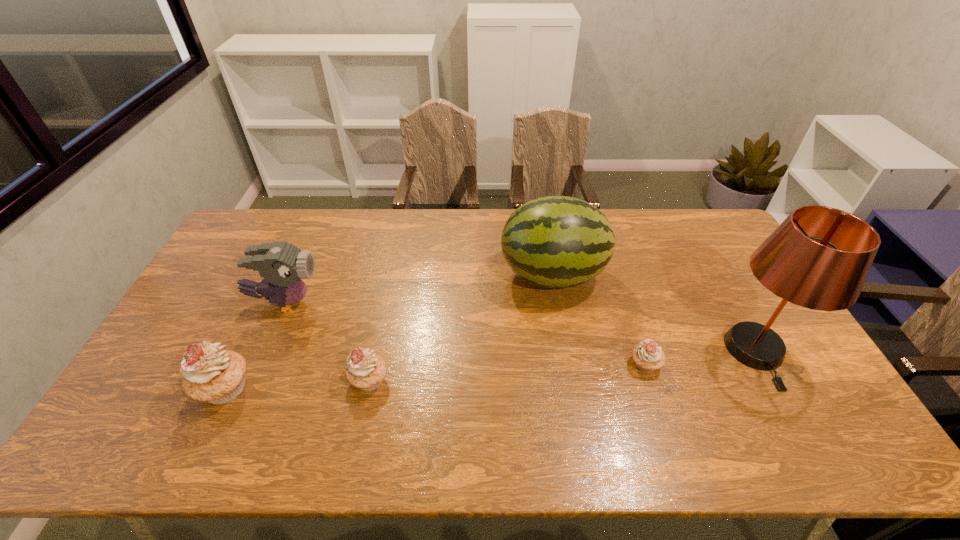
At what (x,y) coordinates should I click in order to perform the action: click on the tallest cupcake. Please return your answer as a coordinate pair (x, y). This screenshot has height=540, width=960. Looking at the image, I should click on (210, 374).

Find the location of a particular element. The image size is (960, 540). the leftmost cupcake is located at coordinates 210,374.

Locate an element on the screen. The height and width of the screenshot is (540, 960). the third object from left to right is located at coordinates (366, 370).

Identify the location of the second tallest cupcake. (366, 370).

Locate an element on the screen. The image size is (960, 540). the shortest object is located at coordinates (648, 356).

This screenshot has width=960, height=540. In order to click on the shortest cupcake in this screenshot , I will do `click(648, 356)`.

Where is `bird`? The image size is (960, 540). bird is located at coordinates (282, 265).

At what (x,y) coordinates should I click in order to perform the action: click on the fifth shortest object. Please return your answer as a coordinate pair (x, y). Looking at the image, I should click on (554, 241).

Identify the location of the rightmost object. The width and height of the screenshot is (960, 540). (819, 257).

Locate an element on the screen. The image size is (960, 540). the tallest object is located at coordinates (819, 257).